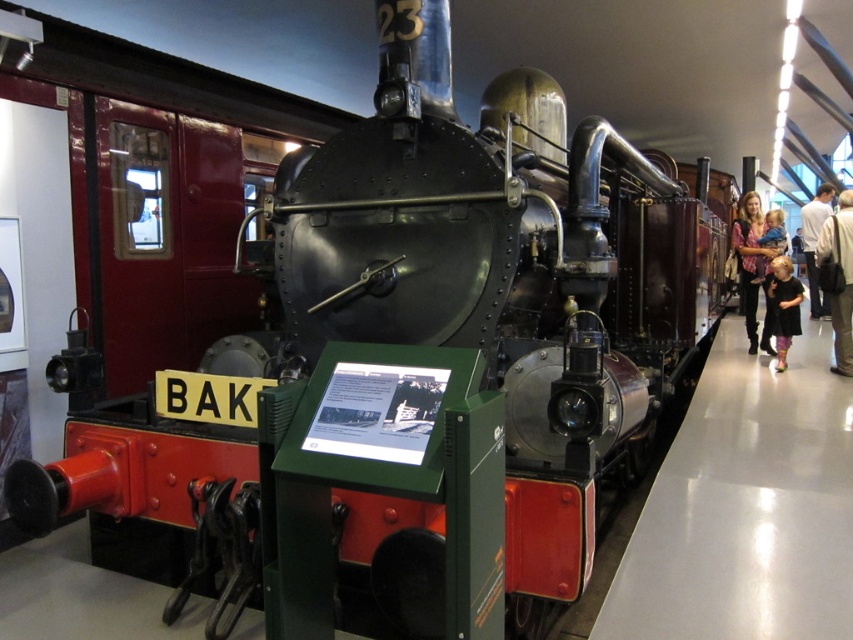
You are a museum visitor who wants to place a 30 cm wide souvenir on the display table. You see the light brown leather jacket at right and the light pink fabric at right. Which object should you choose to place the souvenir next to so it fits better?

The light pink fabric at right has a greater width than the light brown leather jacket at right, so placing the 30 cm wide souvenir next to the light pink fabric at right would provide more space for it to fit better.

You are a museum visitor who wants to take a photo of the vintage steam locomotive. You notice a black dress at lower right and a light pink fabric at right in your viewfinder. Which object should you adjust your camera to avoid blocking the locomotive?

The black dress at lower right is not as tall as the light pink fabric at right, so you should adjust your camera to avoid the light pink fabric at right since it is taller and might block the locomotive more significantly.

You are a museum visitor who wants to take a photo of the locomotive. You notice a black dress at lower right and a light pink fabric at right in the foreground. Which object is closer to the left side of the image?

The black dress at lower right is positioned on the left side of the light pink fabric at right, so the black dress at lower right is closer to the left side of the image.